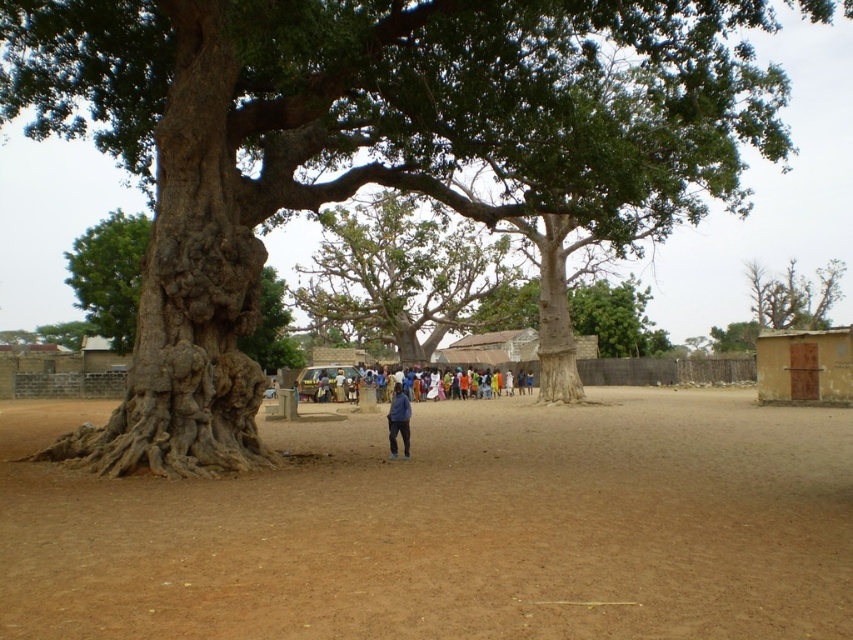
You are a bird looking for a place to perch. You see the green rough bark tree at upper left and the brown mud hut at right. Which one is taller?

The green rough bark tree at upper left is much taller than the brown mud hut at right, so the tree is the taller option for perching.

You are standing in a rural area with a large tree and a group of people nearby. There is a point marked at coordinates (589, 467). If you want to reach that point quickly, should you head towards the tree or the group of people?

The point at (589, 467) is 13.75 meters away from you. Since the group of people is in the background and the tree is in the foreground, you should head towards the tree to reach the point more quickly.

You are standing in the rural scene near the large tree. You notice two points marked in the image. Which point, point (115,280) or point (775,388), is closer to you?

Point (115,280) is closer to you because it is further to the viewer than point (775,388).